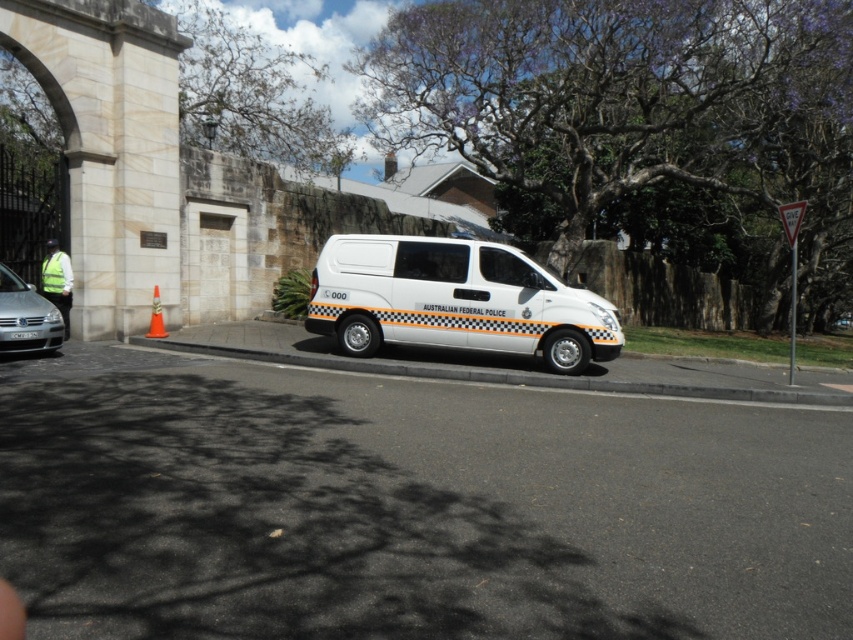
Question: Which is farther from the orange plastic cone at lower left?

Choices:
 (A) white matte van at center
 (B) silver metallic sedan at lower left
 (C) white asphalt curb at lower center

Answer: (A)

Question: Does white matte van at center appear under silver metallic sedan at lower left?

Choices:
 (A) no
 (B) yes

Answer: (A)

Question: Considering the real-world distances, which object is closest to the white matte van at center?

Choices:
 (A) white asphalt curb at lower center
 (B) silver metallic sedan at lower left

Answer: (A)

Question: Which object is positioned farthest from the white asphalt curb at lower center?

Choices:
 (A) white matte van at center
 (B) silver metallic sedan at lower left
 (C) orange plastic cone at lower left

Answer: (B)

Question: Can you confirm if white asphalt curb at lower center is wider than orange plastic cone at lower left?

Choices:
 (A) yes
 (B) no

Answer: (A)

Question: Does white matte van at center appear on the left side of white asphalt curb at lower center?

Choices:
 (A) yes
 (B) no

Answer: (A)